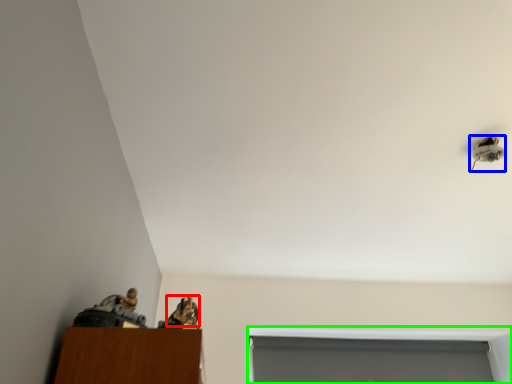
Question: Considering the real-world distances, which object is closest to animal (highlighted by a red box)? lamp (highlighted by a blue box) or window (highlighted by a green box).

Choices:
 (A) lamp
 (B) window

Answer: (A)